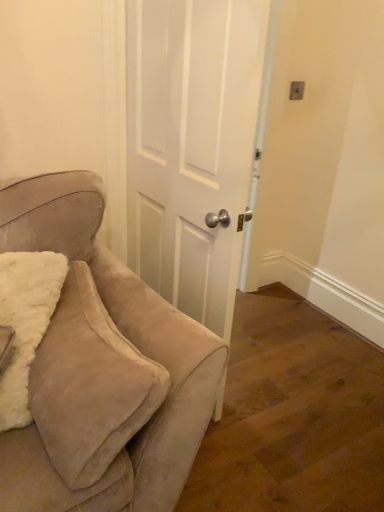
Question: Considering the relative sizes of suede beige chair at left and white matte door at center in the image provided, is suede beige chair at left bigger than white matte door at center?

Choices:
 (A) yes
 (B) no

Answer: (B)

Question: Is suede beige chair at left in front of white matte door at center?

Choices:
 (A) no
 (B) yes

Answer: (B)

Question: Can you confirm if suede beige chair at left is taller than white matte door at center?

Choices:
 (A) yes
 (B) no

Answer: (B)

Question: From the image's perspective, is suede beige chair at left below white matte door at center?

Choices:
 (A) no
 (B) yes

Answer: (B)

Question: Can you confirm if suede beige chair at left is shorter than white matte door at center?

Choices:
 (A) yes
 (B) no

Answer: (A)

Question: From a real-world perspective, is suede beige chair at left beneath white matte door at center?

Choices:
 (A) no
 (B) yes

Answer: (B)

Question: Does white matte door at center appear on the left side of suede beige chair at left?

Choices:
 (A) no
 (B) yes

Answer: (A)

Question: Can you confirm if white matte door at center is taller than suede beige chair at left?

Choices:
 (A) no
 (B) yes

Answer: (B)

Question: Can suede beige chair at left be found inside white matte door at center?

Choices:
 (A) no
 (B) yes

Answer: (A)

Question: Is white matte door at center in front of suede beige chair at left?

Choices:
 (A) yes
 (B) no

Answer: (B)

Question: Is white matte door at center bigger than suede beige chair at left?

Choices:
 (A) no
 (B) yes

Answer: (B)

Question: From a real-world perspective, is white matte door at center below suede beige chair at left?

Choices:
 (A) yes
 (B) no

Answer: (B)

Question: Is point [216, 143] closer or farther from the camera than point [43, 505]?

Choices:
 (A) farther
 (B) closer

Answer: (A)